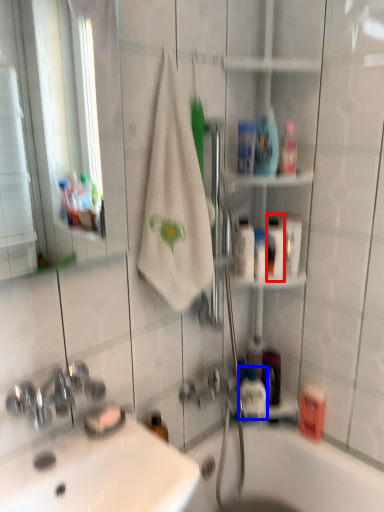
Question: Which point is closer to the camera, mouthwash (highlighted by a red box) or mouthwash (highlighted by a blue box)?

Choices:
 (A) mouthwash
 (B) mouthwash

Answer: (A)